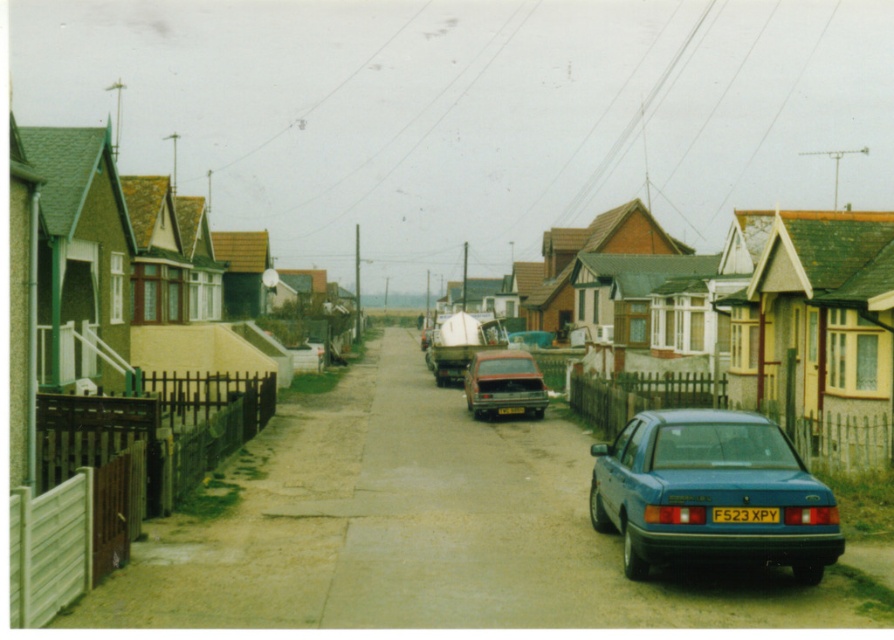
You are standing on the residential street and want to determine which of the two points, point (643,465) or point (488,392), is nearer to you. Based on the scene description, which point is closer?

Point (643,465) is closer to the camera than point (488,392), so it is the nearer point.

You are standing on the residential street and want to walk from point A to point B. Point A is at coordinate point(755, 488) and point B is at coordinate point(504, 412). Which point is closer to you when you start walking?

Point(755, 488) is closer to the viewer than point(504, 412), so you will start at the closer point(755, 488) and walk towards point(504, 412).